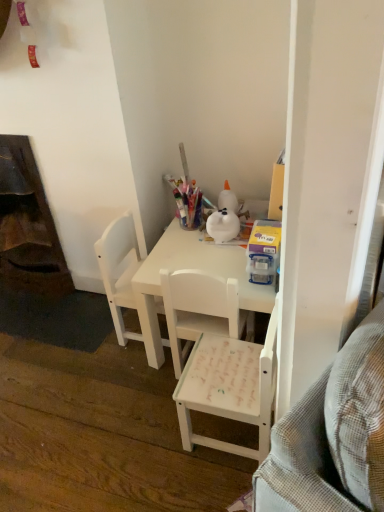
The width and height of the screenshot is (384, 512). I want to click on free space to the left of translucent plastic container at upper right, so click(x=216, y=264).